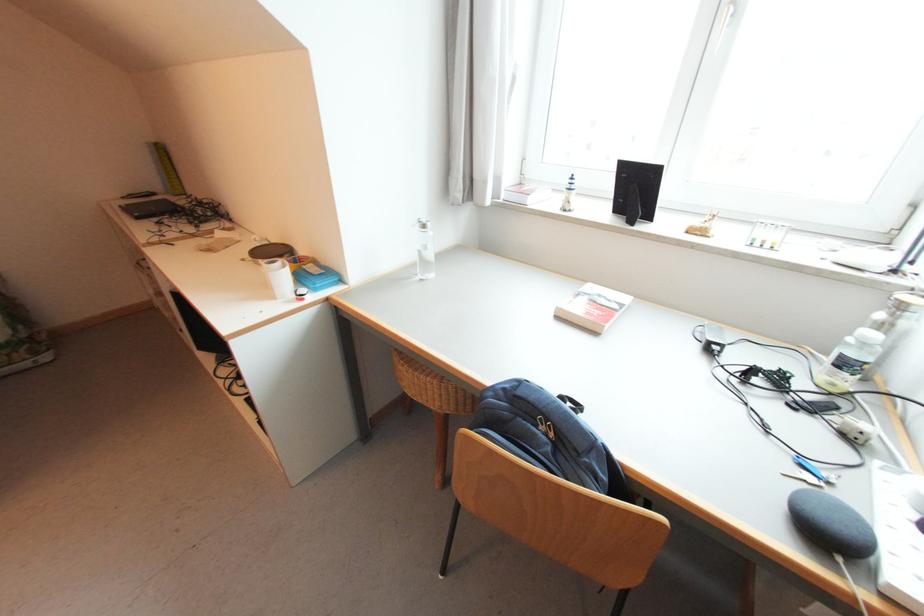
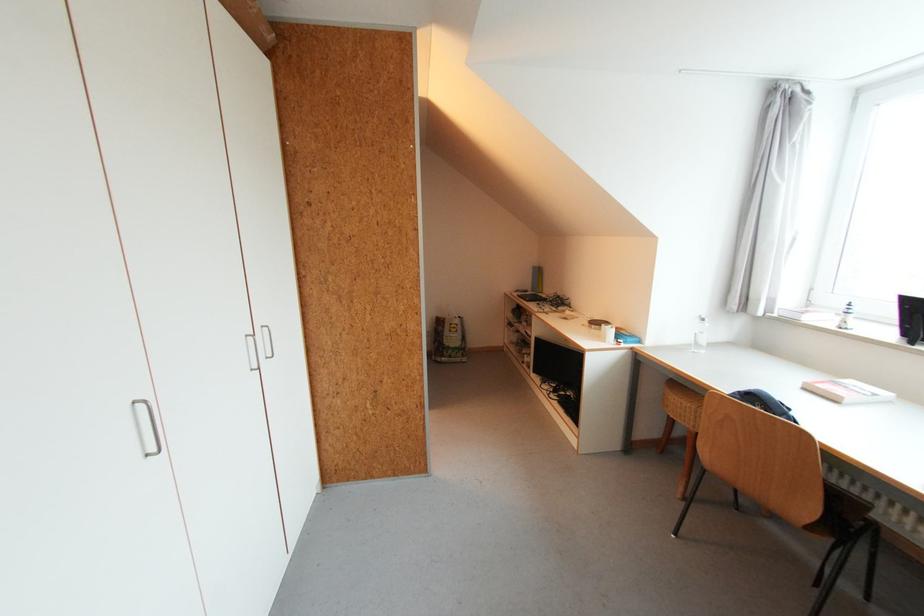
Find the pixel in the second image that matches pixel 600 333 in the first image.

(841, 403)